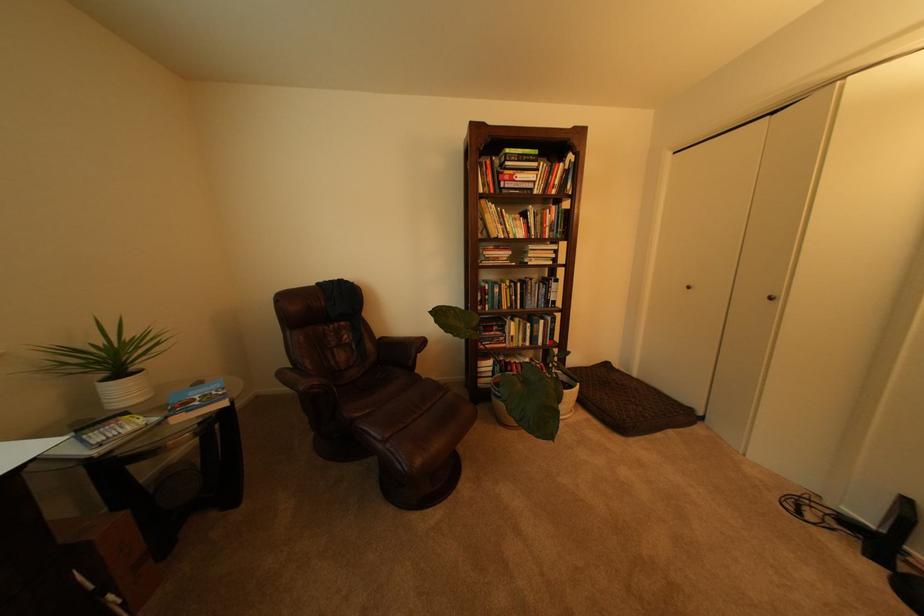
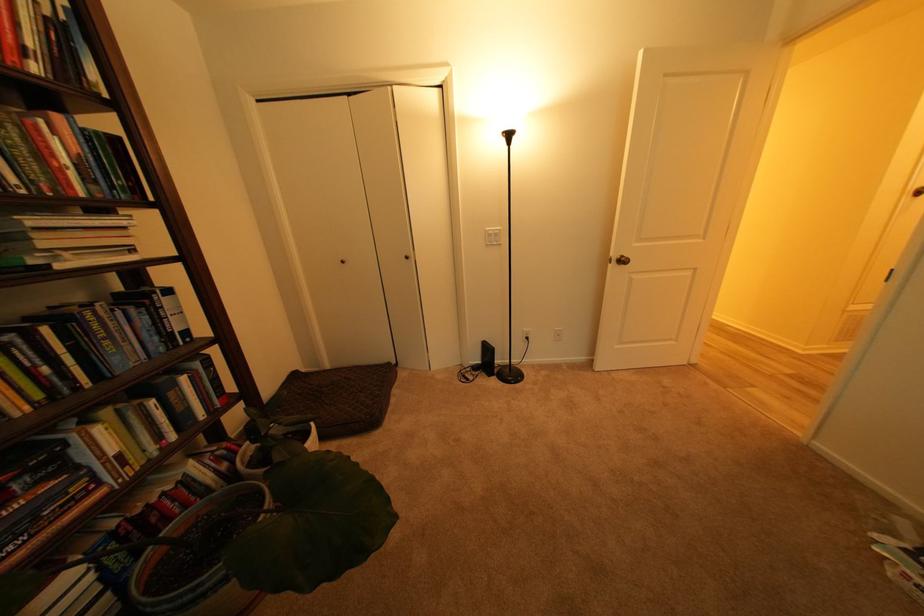
In the second image, find the point that corresponds to (x=552, y=293) in the first image.

(150, 326)